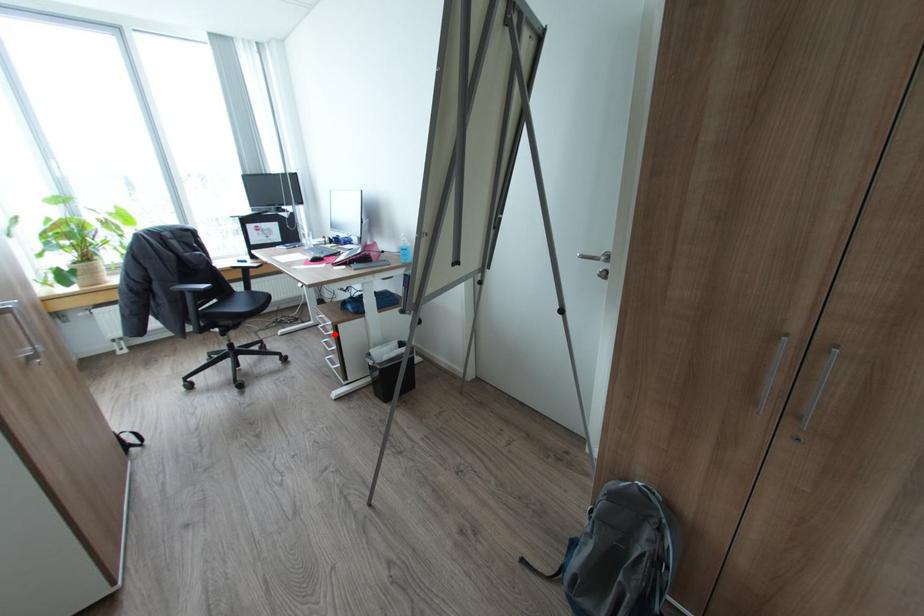
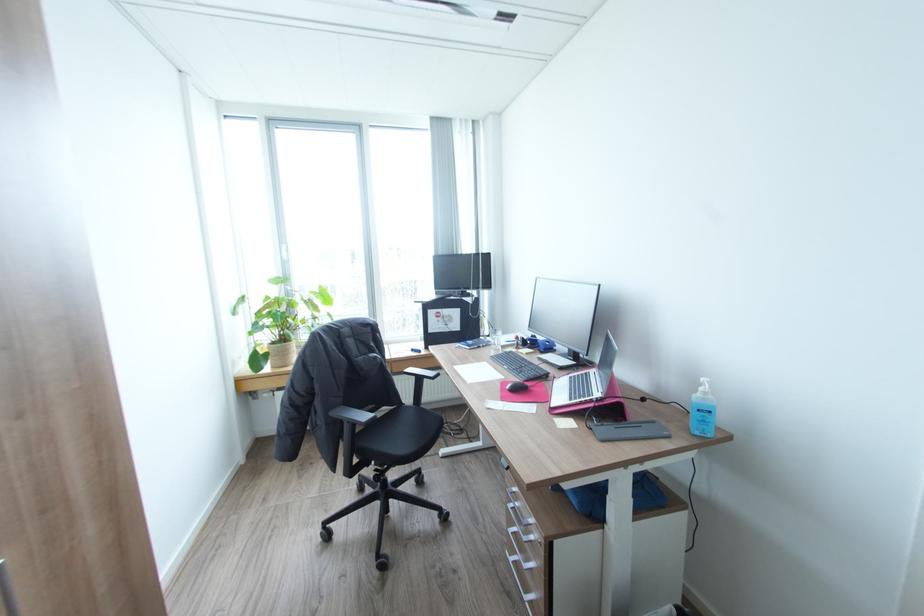
In the second image, find the point that corresponds to the highlighted location in the first image.

(536, 541)